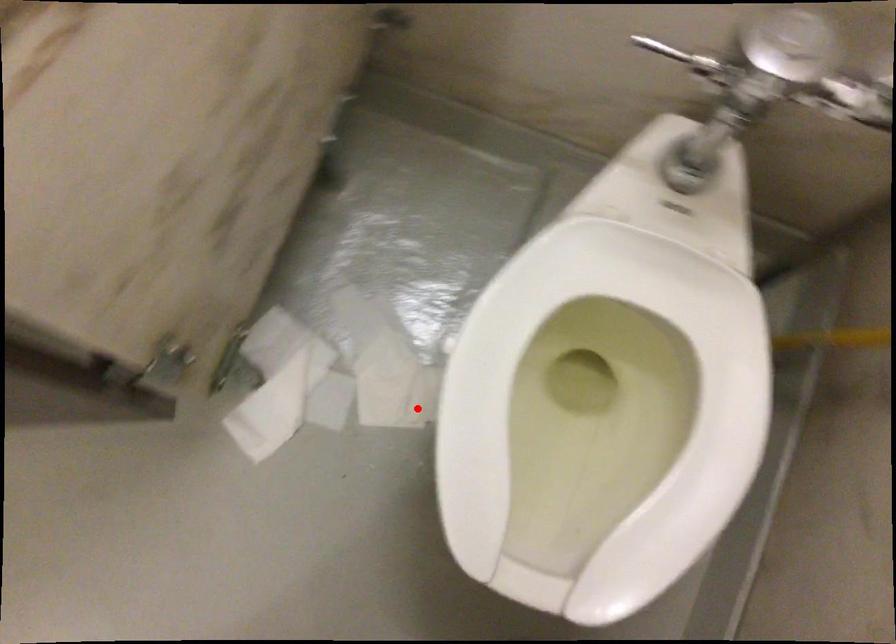
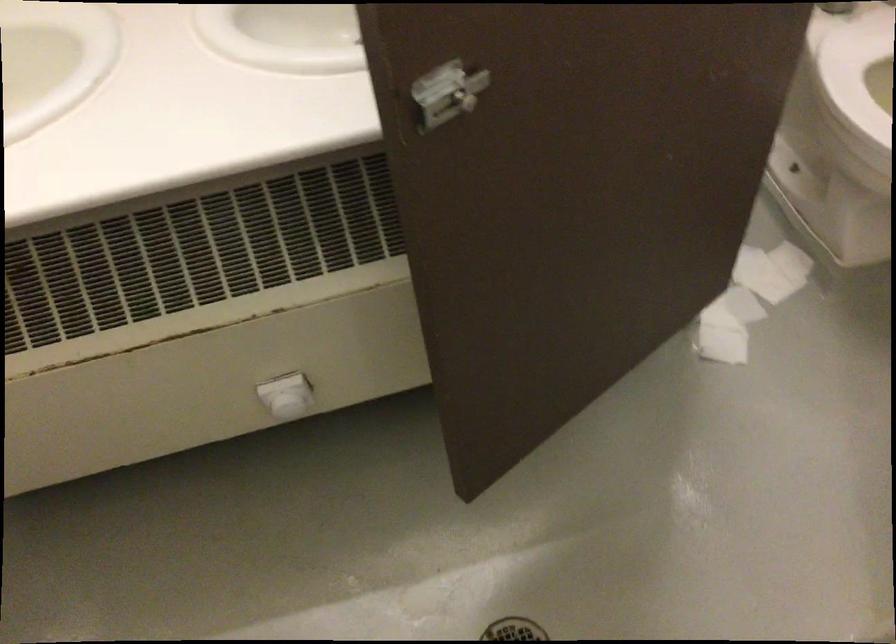
Locate, in the second image, the point that corresponds to the highlighted location in the first image.

(790, 261)